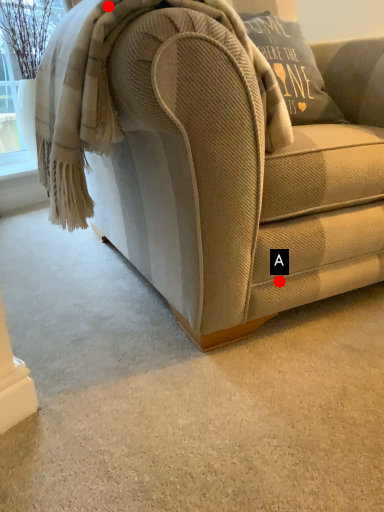
Question: Two points are circled on the image, labeled by A and B beside each circle. Among these points, which one is nearest to the camera?

Choices:
 (A) A is closer
 (B) B is closer

Answer: (B)